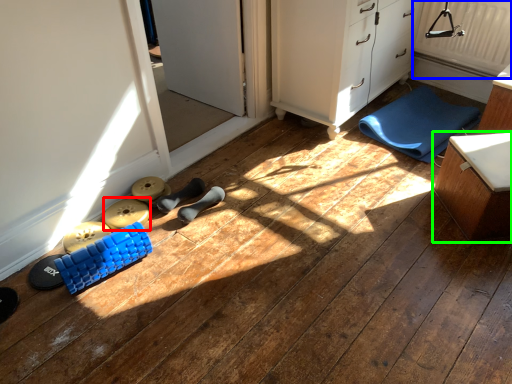
Question: Based on their relative distances, which object is farther from toy (highlighted by a red box)? Choose from radiator (highlighted by a blue box) and furniture (highlighted by a green box).

Choices:
 (A) radiator
 (B) furniture

Answer: (A)